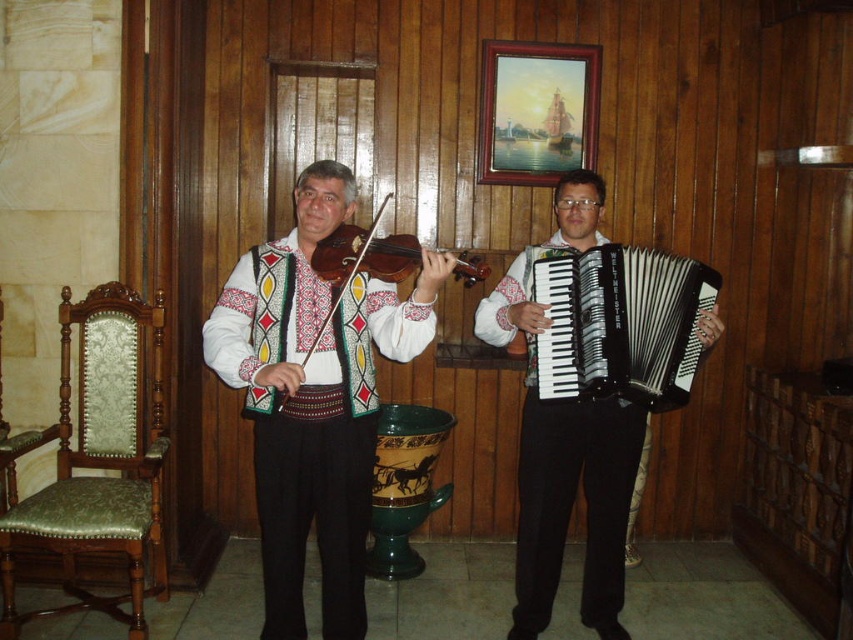
You are a photographer setting up for a concert. You need to position a microphone stand between the matte white violin at center and the black plastic accordion at right. Based on their widths, will the stand fit if it requires 1 meter of space between the instruments?

The matte white violin at center might be wider than the black plastic accordion at right, but without exact measurements, it is uncertain if the 1 meter space requirement for the microphone stand will be met. Further measurement is needed.

You are a photographer positioned in front of the two musicians. You want to take a photo where the matte white violin at center is on the left side of the frame and the black plastic accordion at right is on the right side. Is the current arrangement suitable for this composition?

Yes, the current arrangement is suitable because the matte white violin at center is already positioned to the left of the black plastic accordion at right, matching the desired composition.

You are organizing a music festival and need to know which accordion is bigger to fit into a display case. Which one is larger between the black matte accordion at right and the black plastic accordion at right?

The black matte accordion at right is larger in size than the black plastic accordion at right, so the black matte accordion at right will require a larger display case.